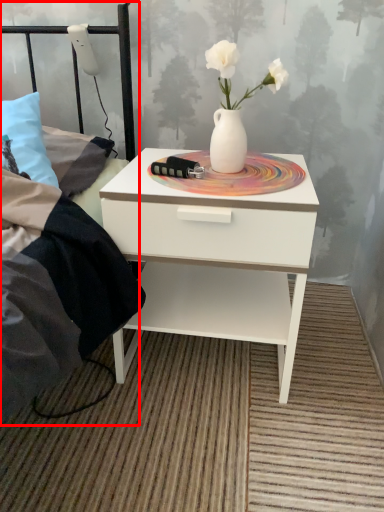
Question: From the image's perspective, what is the correct spatial relationship of bed frame (annotated by the red box) in relation to nightstand?

Choices:
 (A) below
 (B) above

Answer: (B)